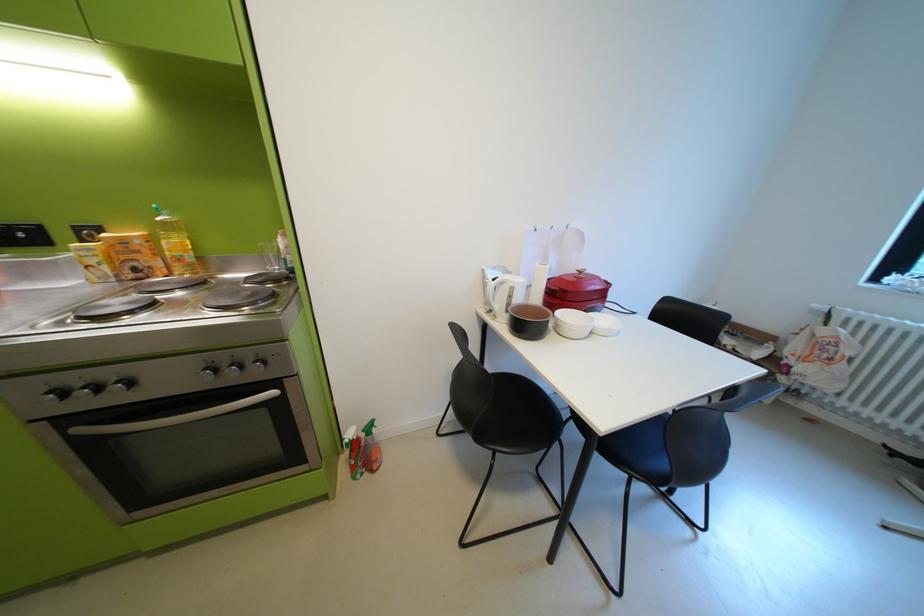
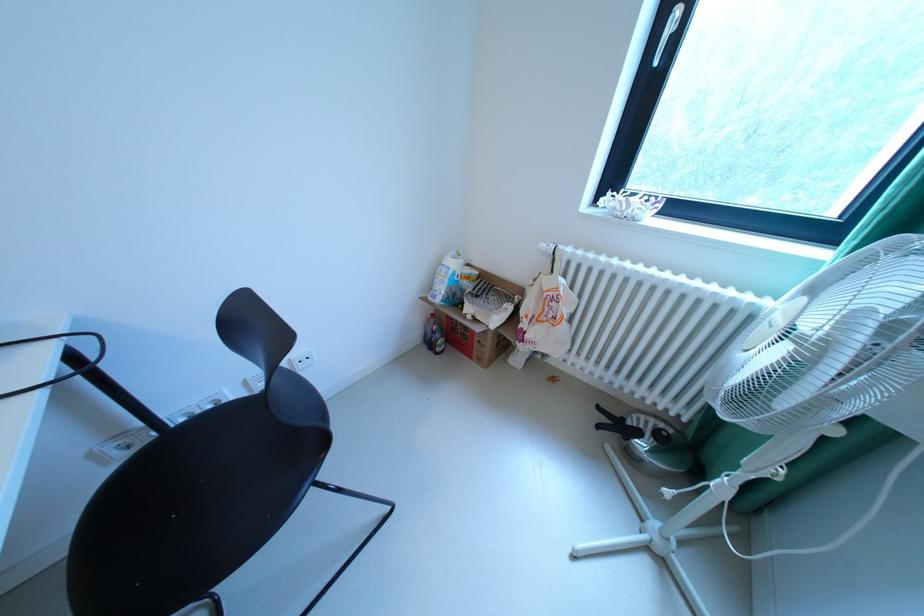
What movement of the cameraman would produce the second image?

The cameraman walked toward right, forward.